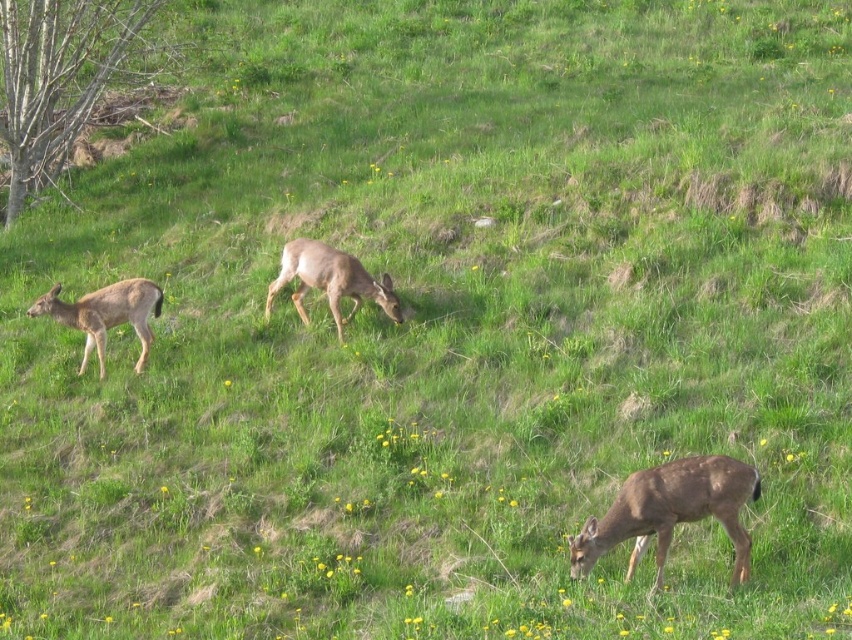
You are a photographer trying to capture a photo of both the brown matte deer at center and the brown fur deer at left in the same frame. Given that your camera has a focal length of 50mm and the minimum distance between the two deer for the camera to focus on both is 1.5 meters, will you be able to take the photo successfully?

The brown matte deer at center and the brown fur deer at left are 1.38 meters apart, which is less than the required 1.5 meters for the camera to focus on both. Therefore, you can successfully take the photo with both deer in focus.

You are standing at the center of the field and see the brown matte deer at lower right. If you want to walk directly towards it, in which direction should you move?

Since the brown matte deer at lower right is located at coordinates approximately 0.802 on the x axis and 0.788 on the y axis, you should move diagonally towards the lower right direction to reach it.